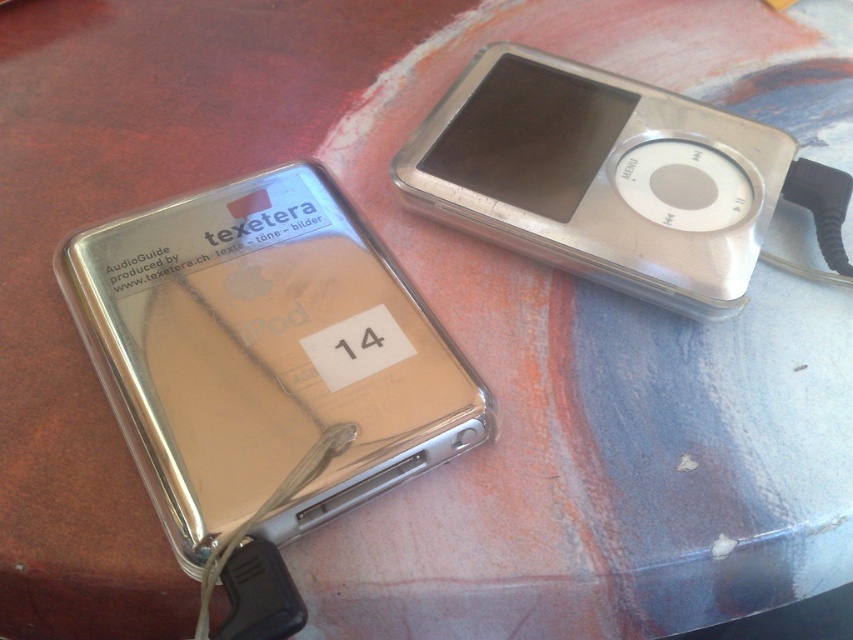
Between point (300, 211) and point (622, 220), which one is positioned behind?

Positioned behind is point (622, 220).

Which is more to the right, satin gold ipod at center or silver metallic ipod at upper right?

silver metallic ipod at upper right is more to the right.

Describe the element at coordinates (264, 355) in the screenshot. I see `satin gold ipod at center` at that location.

At what (x,y) coordinates should I click in order to perform the action: click on satin gold ipod at center. Please return your answer as a coordinate pair (x, y). The image size is (853, 640). Looking at the image, I should click on (264, 355).